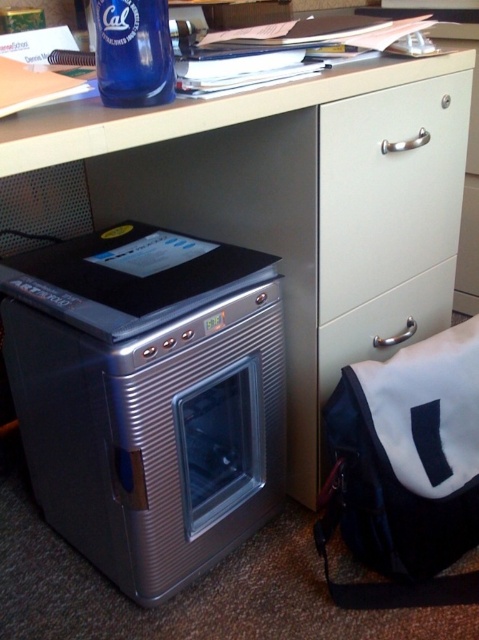
Which is behind, point (209, 310) or point (417, 506)?

The point (417, 506) is more distant.

Is satin silver oven at lower left positioned behind white fabric bag at lower right?

No, it is not.

Is point (259, 316) farther from camera compared to point (436, 588)?

No, (259, 316) is in front of (436, 588).

Locate an element on the screen. This screenshot has height=640, width=479. satin silver oven at lower left is located at coordinates (148, 396).

Is point (403, 445) in front of point (354, 120)?

No, (403, 445) is behind (354, 120).

Can you confirm if white fabric bag at lower right is bigger than white matte cabinet handle at center?

No.

Which is behind, point (442, 481) or point (344, 272)?

The point (344, 272) is more distant.

This screenshot has width=479, height=640. Identify the location of white fabric bag at lower right. (406, 472).

Is satin silver oven at lower left smaller than blue glass bottle at upper left?

Incorrect, satin silver oven at lower left is not smaller in size than blue glass bottle at upper left.

You are a GUI agent. You are given a task and a screenshot of the screen. Output one action in this format:
    pyautogui.click(x=<x>, y=<y>)
    Task: Click on the satin silver oven at lower left
    The height and width of the screenshot is (640, 479).
    Given the screenshot: What is the action you would take?
    pyautogui.click(x=148, y=396)